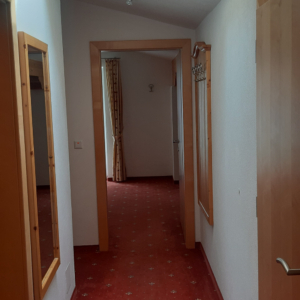
Locate an element on the screen. hallway is located at coordinates (137, 287), (147, 251), (148, 230).